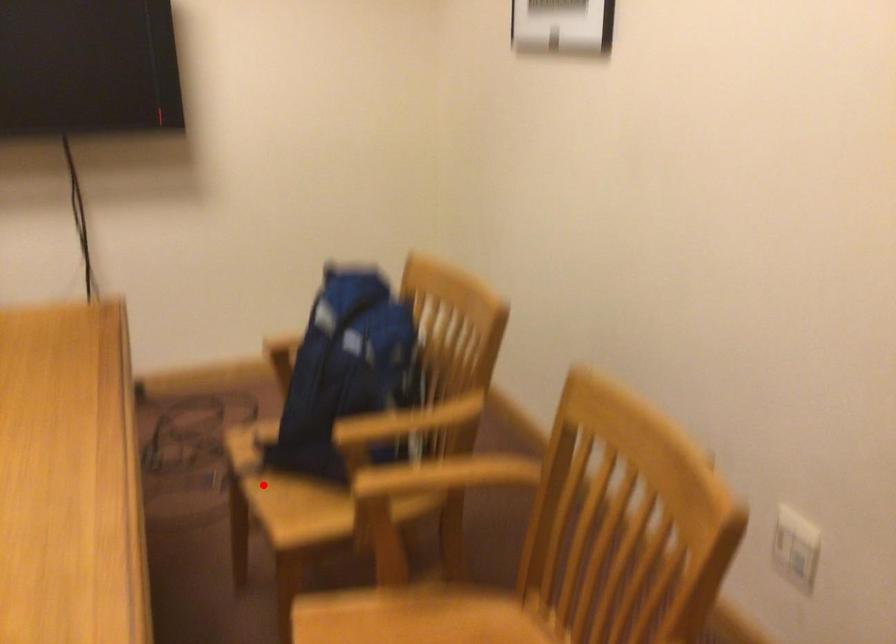
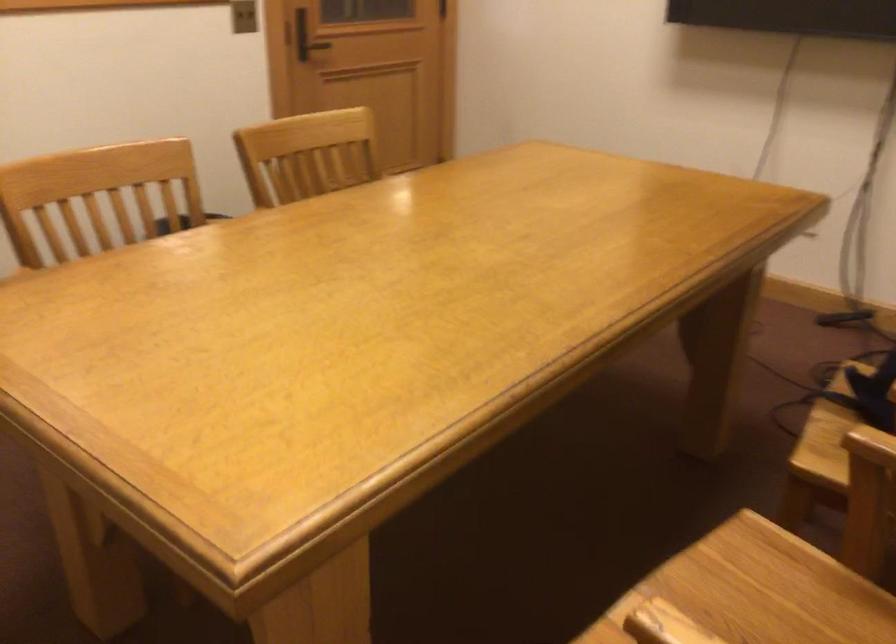
Question: I am providing you with two images of the same scene from different viewpoints. A red point is shown in image1. For the corresponding object point in image2, is it positioned nearer or farther from the camera?

Choices:
 (A) Nearer
 (B) Farther

Answer: (A)